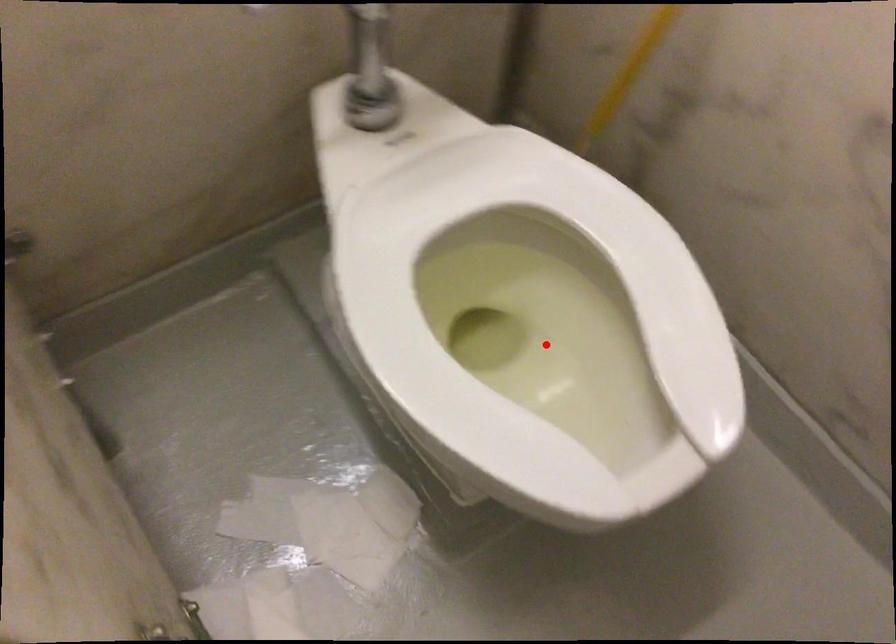
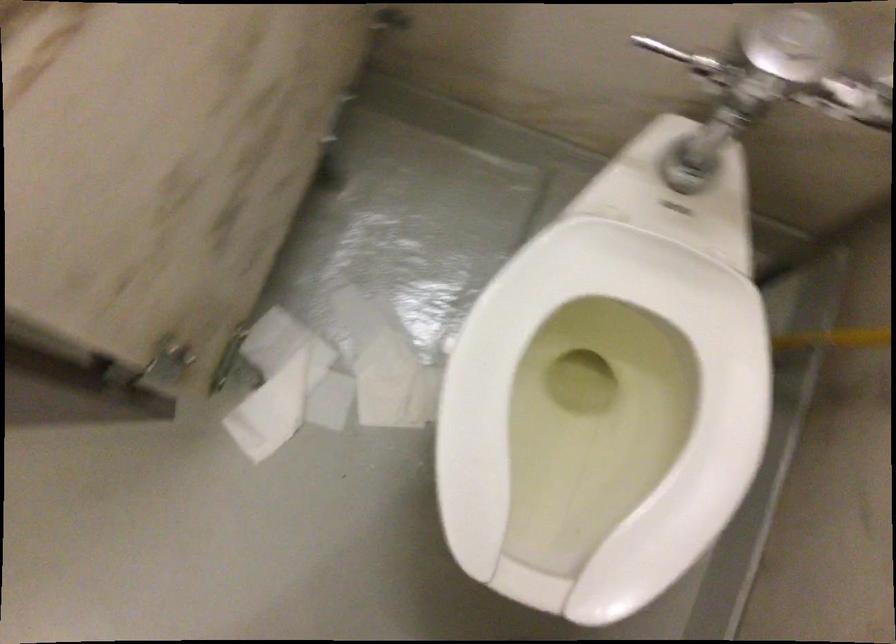
Locate, in the second image, the point that corresponds to the highlighted location in the first image.

(600, 415)